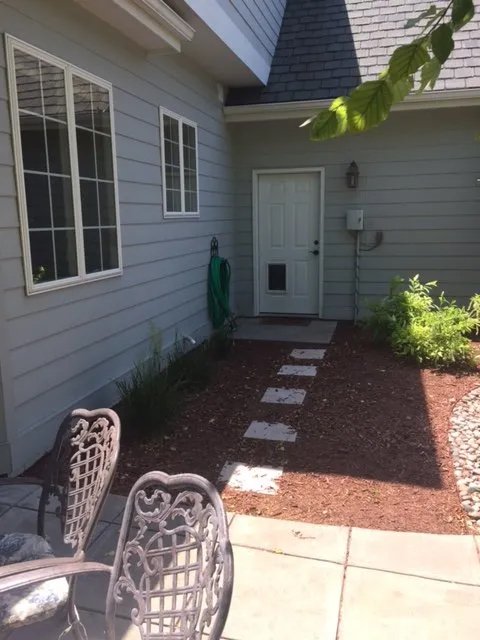
This screenshot has width=480, height=640. Identify the location of plant. (440, 317).